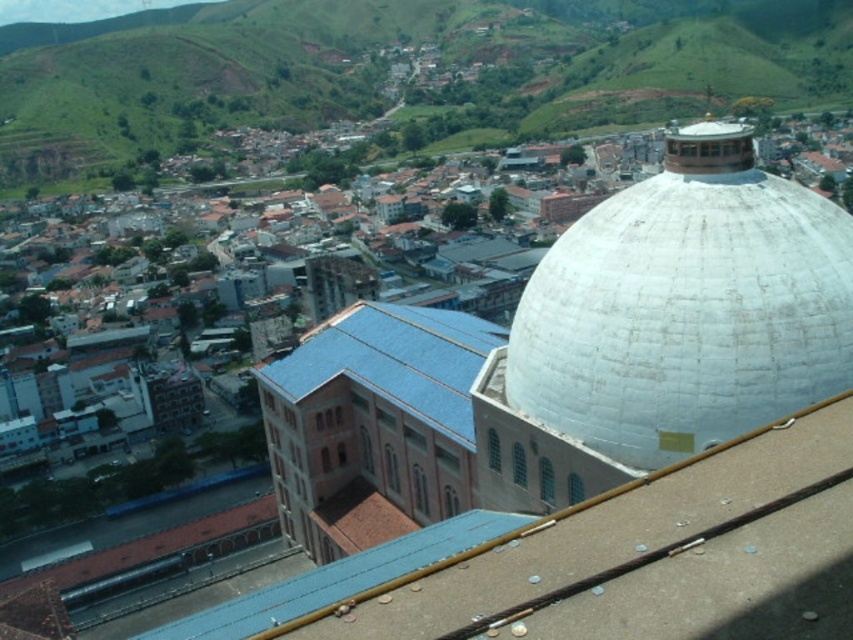
You are standing at the point closer to the camera in the image. Which point are you at, point (828,60) or point (312,355)?

You are at point (828,60) because it is further to the camera than point (312,355).

You are a tourist standing in front of the large white dome structure. You notice the green grassy hillside at upper center and the blue tile roof at center. Which of these two objects is bigger in size?

The green grassy hillside at upper center is larger in size compared to the blue tile roof at center according to the description.

You are standing at the entrance of the town and want to take a photo of both the white matte dome at upper right and the blue tile roof at center. Which object should you position closer to the front of your camera frame to ensure both are fully visible in the photo?

Since the white matte dome at upper right is much taller than the blue tile roof at center, you should position the blue tile roof at center closer to the front of your camera frame. This way, the taller dome will fit within the frame without cropping the shorter roof.